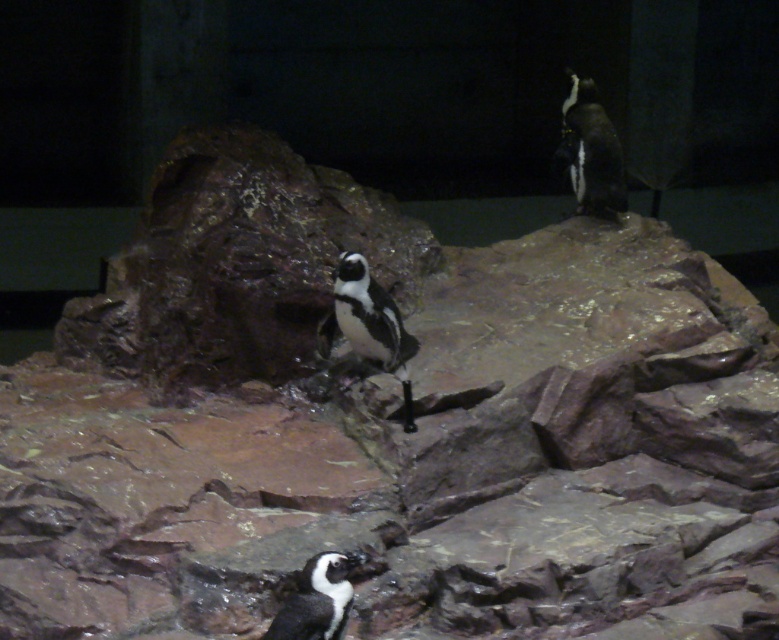
You are a zookeeper observing the penguins in their rocky enclosure. You notice the black matte penguin at center and the black glossy penguin at lower center. Which penguin is bigger?

The black matte penguin at center is larger in size compared to the black glossy penguin at lower center.

You are a zookeeper observing the penguins in their rocky enclosure. You notice the black matte penguin at center and the black and white feathers at upper right. Which penguin is positioned closer to your viewpoint?

The black matte penguin at center is closer to the viewer than the black and white feathers at upper right.

You are observing the penguins in the rocky environment. The black and white feathers at upper right are part of which penguin? Please specify its position relative to the other penguins.

The black and white feathers at upper right are part of the penguin positioned at the center, which is at a higher elevation than the penguin on the left foreground and lower than the one at the back right.